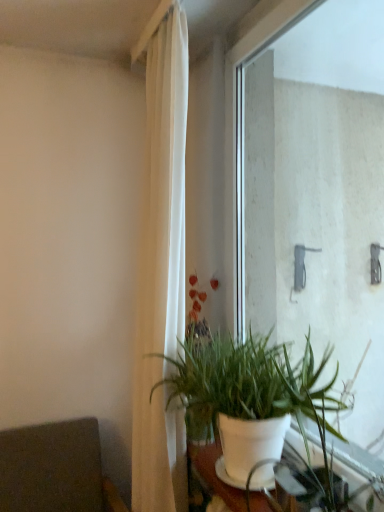
Measure the distance between white matte pot at lower center and camera.

A distance of 1.16 meters exists between white matte pot at lower center and camera.

The height and width of the screenshot is (512, 384). Find the location of `transparent glass window at center`. transparent glass window at center is located at coordinates (317, 196).

The width and height of the screenshot is (384, 512). What do you see at coordinates (55, 469) in the screenshot? I see `dark gray fabric armchair at lower left` at bounding box center [55, 469].

Where is `dark gray fabric armchair at lower left`? Image resolution: width=384 pixels, height=512 pixels. dark gray fabric armchair at lower left is located at coordinates [x=55, y=469].

The width and height of the screenshot is (384, 512). Find the location of `white matte pot at lower center`. white matte pot at lower center is located at coordinates pos(246,394).

Locate an element on the screen. The width and height of the screenshot is (384, 512). houseplant lying below the white fabric curtain at center (from the image's perspective) is located at coordinates (246, 394).

Considering the sizes of white fabric curtain at center and white matte pot at lower center in the image, is white fabric curtain at center taller or shorter than white matte pot at lower center?

white fabric curtain at center is taller than white matte pot at lower center.

Can you confirm if white fabric curtain at center is smaller than white matte pot at lower center?

Actually, white fabric curtain at center might be larger than white matte pot at lower center.

Does point (177, 133) come closer to viewer compared to point (218, 383)?

No, it is not.

Considering the sizes of objects white matte pot at lower center and white fabric curtain at center in the image provided, who is shorter, white matte pot at lower center or white fabric curtain at center?

white matte pot at lower center is shorter.

Is white matte pot at lower center outside of white fabric curtain at center?

Yes, white matte pot at lower center is outside of white fabric curtain at center.

From the image's perspective, is white matte pot at lower center beneath white fabric curtain at center?

Indeed, from the image's perspective, white matte pot at lower center is shown beneath white fabric curtain at center.

Considering their positions, is white matte pot at lower center located in front of or behind white fabric curtain at center?

white matte pot at lower center is positioned closer to the viewer than white fabric curtain at center.

Is point (185, 356) positioned after point (61, 464)?

No, it is in front of (61, 464).

Can you confirm if white matte pot at lower center is bigger than dark gray fabric armchair at lower left?

Actually, white matte pot at lower center might be smaller than dark gray fabric armchair at lower left.

Considering the positions of objects white matte pot at lower center and dark gray fabric armchair at lower left in the image provided, who is more to the left, white matte pot at lower center or dark gray fabric armchair at lower left?

dark gray fabric armchair at lower left is more to the left.

Is white matte pot at lower center facing towards dark gray fabric armchair at lower left?

No, white matte pot at lower center is not turned towards dark gray fabric armchair at lower left.

How much distance is there between white fabric curtain at center and transparent glass window at center?

A distance of 30.76 inches exists between white fabric curtain at center and transparent glass window at center.

Is white fabric curtain at center not close to transparent glass window at center?

white fabric curtain at center is actually quite close to transparent glass window at center.

Who is taller, white fabric curtain at center or transparent glass window at center?

white fabric curtain at center.

Is transparent glass window at center surrounded by white fabric curtain at center?

That's incorrect, transparent glass window at center is not inside white fabric curtain at center.

Can you tell me how much white fabric curtain at center and dark gray fabric armchair at lower left differ in facing direction?

They differ by 90 degrees in their facing directions.

Is white fabric curtain at center with dark gray fabric armchair at lower left?

No, white fabric curtain at center is not touching dark gray fabric armchair at lower left.

Based on the photo, which object is thinner, white fabric curtain at center or dark gray fabric armchair at lower left?

With smaller width is white fabric curtain at center.

Is point (153, 38) closer or farther from the camera than point (15, 432)?

Point (153, 38).

From a real-world perspective, which object rests below the other?

white matte pot at lower center.

How different are the orientations of white matte pot at lower center and transparent glass window at center in degrees?

The facing directions of white matte pot at lower center and transparent glass window at center are 0.00106 degrees apart.

Based on the photo, could you tell me if white matte pot at lower center is facing transparent glass window at center?

No, white matte pot at lower center is not oriented towards transparent glass window at center.

Does white matte pot at lower center have a lesser width compared to transparent glass window at center?

In fact, white matte pot at lower center might be wider than transparent glass window at center.

Is dark gray fabric armchair at lower left facing towards transparent glass window at center?

No.

From a real-world perspective, which object rests below the other?

dark gray fabric armchair at lower left, from a real-world perspective.

Considering the positions of objects dark gray fabric armchair at lower left and transparent glass window at center in the image provided, who is in front, dark gray fabric armchair at lower left or transparent glass window at center?

transparent glass window at center is more forward.

Image resolution: width=384 pixels, height=512 pixels. Identify the location of curtain behind the white matte pot at lower center. (162, 274).

Where is `curtain on the left of white matte pot at lower center`? The image size is (384, 512). curtain on the left of white matte pot at lower center is located at coordinates (162, 274).

Which object lies nearer to the anchor point transparent glass window at center, white fabric curtain at center or white matte pot at lower center?

white matte pot at lower center lies closer to transparent glass window at center than the other object.

Based on their spatial positions, is transparent glass window at center or white matte pot at lower center closer to white fabric curtain at center?

Among the two, white matte pot at lower center is located nearer to white fabric curtain at center.

From the image, which object appears to be farther from white matte pot at lower center, transparent glass window at center or dark gray fabric armchair at lower left?

Based on the image, dark gray fabric armchair at lower left appears to be further to white matte pot at lower center.

When comparing their distances from dark gray fabric armchair at lower left, does white matte pot at lower center or transparent glass window at center seem closer?

white matte pot at lower center is positioned closer to the anchor dark gray fabric armchair at lower left.

When comparing their distances from dark gray fabric armchair at lower left, does white matte pot at lower center or white fabric curtain at center seem further?

white matte pot at lower center.

When comparing their distances from dark gray fabric armchair at lower left, does transparent glass window at center or white matte pot at lower center seem further?

Based on the image, transparent glass window at center appears to be further to dark gray fabric armchair at lower left.

When comparing their distances from white fabric curtain at center, does dark gray fabric armchair at lower left or white matte pot at lower center seem closer?

white matte pot at lower center.

Considering their positions, is dark gray fabric armchair at lower left positioned closer to transparent glass window at center than white fabric curtain at center?

white fabric curtain at center lies closer to transparent glass window at center than the other object.

The height and width of the screenshot is (512, 384). In order to click on houseplant between white fabric curtain at center and dark gray fabric armchair at lower left vertically in this screenshot , I will do `click(246, 394)`.

Identify the location of curtain between transparent glass window at center and white matte pot at lower center vertically. (x=162, y=274).

Locate an element on the screen. houseplant between transparent glass window at center and dark gray fabric armchair at lower left from top to bottom is located at coordinates (246, 394).

This screenshot has width=384, height=512. I want to click on curtain between transparent glass window at center and dark gray fabric armchair at lower left from top to bottom, so click(x=162, y=274).